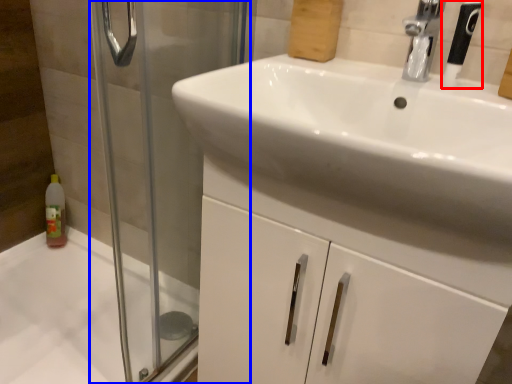
Question: Which object appears closest to the camera in this image, shower (highlighted by a red box) or screen door (highlighted by a blue box)?

Choices:
 (A) shower
 (B) screen door

Answer: (B)